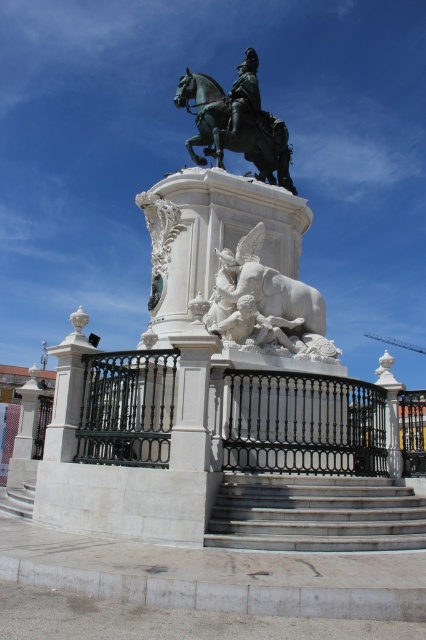
You are a delivery person with a cart that is 10 feet wide. You need to move your cart from the black wrought iron fence at lower center to the white marble elephant at center. Is there enough space between them for your cart to pass through?

The distance between the black wrought iron fence at lower center and the white marble elephant at center is 21.15 feet, which is more than enough space for a 10 feet wide cart to pass through.

From the picture: You are a painter standing at the base of the statue and want to paint both the black wrought iron fence at lower center and the white marble statue at center. Which object should you look up to paint first?

The black wrought iron fence at lower center has a greater height compared to the white marble statue at center, so you should look up to paint the black wrought iron fence at lower center first because it is taller.

You are standing at the bottom of the steps leading to the equestrian statue. You want to walk directly towards the statue. Is the black wrought iron fence at lower center blocking your path?

The black wrought iron fence at lower center is positioned at point (302, 422), which is along the path leading to the statue. Therefore, the black wrought iron fence at lower center is blocking your path.